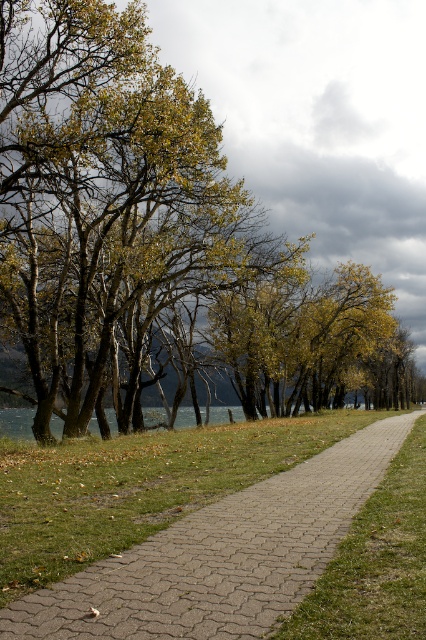
You are standing on the pebble gray pavement at center and want to walk towards the green leafy tree at center. Can you walk directly under the tree without stepping off the pavement?

The green leafy tree at center is positioned over the pebble gray pavement at center, so yes, you can walk directly under the tree while staying on the pavement.

From the picture: You are standing on the pebble gray pavement at center and want to walk towards the green leafy tree at center. Is the tree closer to you or further away?

The green leafy tree at center is further to the viewer than the pebble gray pavement at center, so the tree is actually further away from you than the pavement you are standing on. Therefore, the tree is further away from you.

You are standing at the starting point of the pathway and want to reach the end point. Which point, point (201,250) or point (161,602), is closer to your current position?

Point (161,602) is closer to your current position because it is in front of point (201,250), which is behind it.